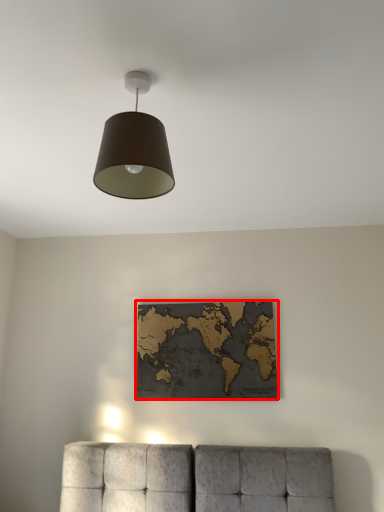
Question: From the image's perspective, where is picture frame (annotated by the red box) located in relation to lamp in the image?

Choices:
 (A) above
 (B) below

Answer: (B)